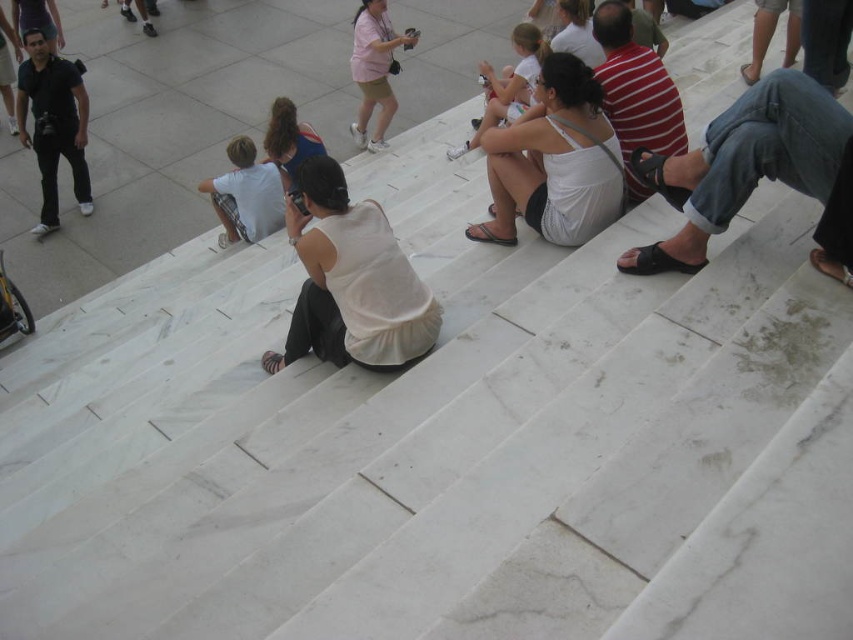
Question: Is matte black camera at left to the left of white cotton shirt at center from the viewer's perspective?

Choices:
 (A) no
 (B) yes

Answer: (B)

Question: Which of the following is the farthest from the observer?

Choices:
 (A) denim shorts at upper right
 (B) pink cotton shirt at upper center
 (C) white cotton shirt at center

Answer: (B)

Question: Which of these objects is positioned closest to the white fabric dress at center?

Choices:
 (A) black leather sandals at right
 (B) denim shorts at upper right
 (C) striped cotton shirt at center
 (D) matte black camera at left

Answer: (C)

Question: Can you confirm if matte black camera at left is bigger than white cotton dress at center?

Choices:
 (A) no
 (B) yes

Answer: (B)

Question: Which point is closer to the camera?

Choices:
 (A) (300, 154)
 (B) (514, 147)
 (C) (776, 16)
 (D) (523, 77)

Answer: (B)

Question: Is white fabric dress at center in front of matte blue tank top at center?

Choices:
 (A) no
 (B) yes

Answer: (B)